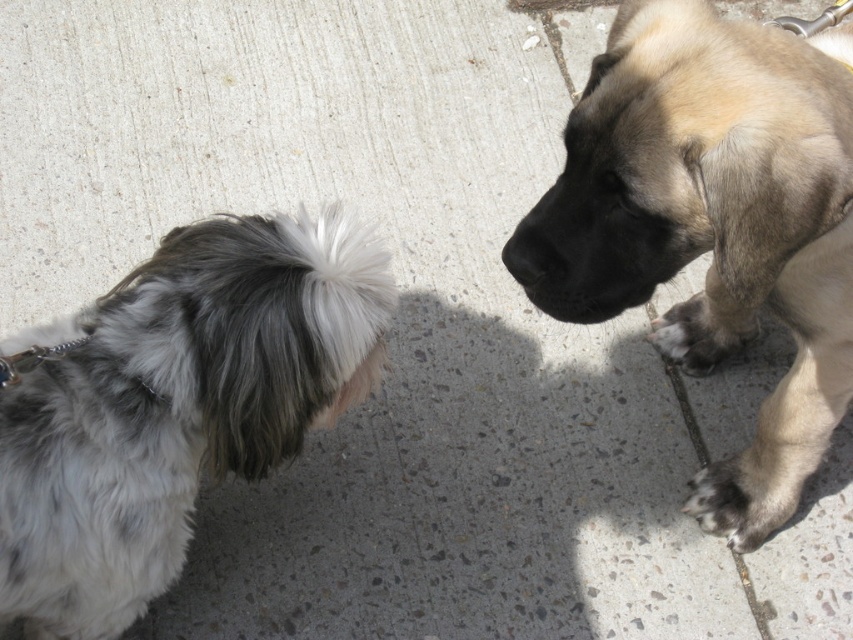
Question: Can you confirm if light brown fur at center is positioned to the left of gray and white fur at left?

Choices:
 (A) yes
 (B) no

Answer: (B)

Question: From the image, what is the correct spatial relationship of dark brown fur paw at lower right in relation to black smooth nose at center?

Choices:
 (A) left
 (B) right

Answer: (B)

Question: Which object is farther from the camera taking this photo?

Choices:
 (A) black smooth nose at center
 (B) light brown fur at center
 (C) dark brown fur paw at lower right
 (D) gray and white fur at left

Answer: (C)

Question: Considering the real-world distances, which object is farthest from the gray and white fur at left?

Choices:
 (A) black smooth nose at center
 (B) dark brown fur paw at lower right
 (C) light brown fur at center

Answer: (B)

Question: Which object is the farthest from the gray and white fur at left?

Choices:
 (A) fuzzy beige paw at lower right
 (B) light brown fur at center
 (C) black smooth nose at center

Answer: (A)

Question: Can you confirm if dark brown fur paw at lower right is positioned above black smooth nose at center?

Choices:
 (A) no
 (B) yes

Answer: (A)